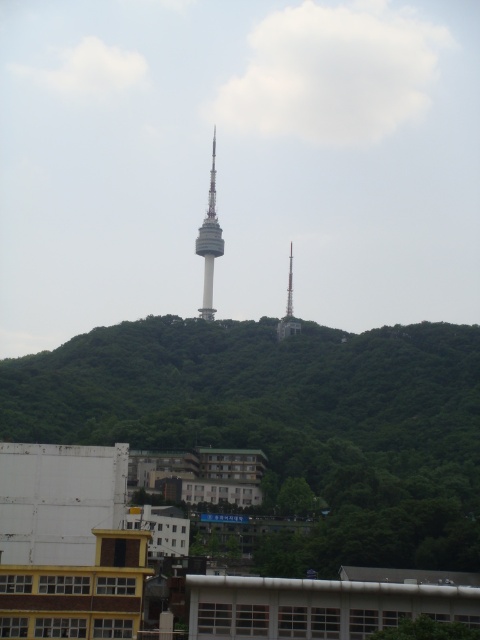
You are standing in the landscape scene and want to determine which of the two points, point (189,324) or point (212,220), is closer to you. Based on the image, which point is nearer?

Point (189,324) is closer to the viewer than point (212,220).

You are a photographer planning to capture the entire scene in one shot. Given that the green leafy hillside at center and the gray concrete tower at center are both in the frame, which object occupies more horizontal space in the photo?

The green leafy hillside at center occupies more horizontal space than the gray concrete tower at center because its width surpasses the tower.